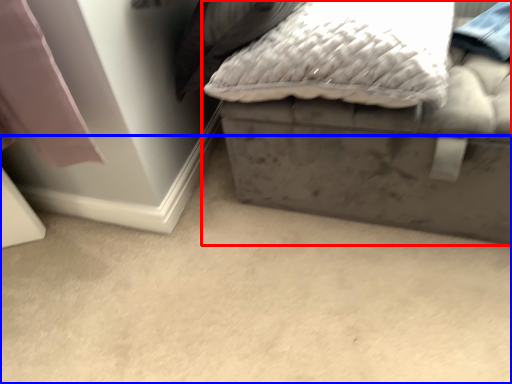
Question: Which object appears farthest to the camera in this image, furniture (highlighted by a red box) or concrete (highlighted by a blue box)?

Choices:
 (A) furniture
 (B) concrete

Answer: (A)